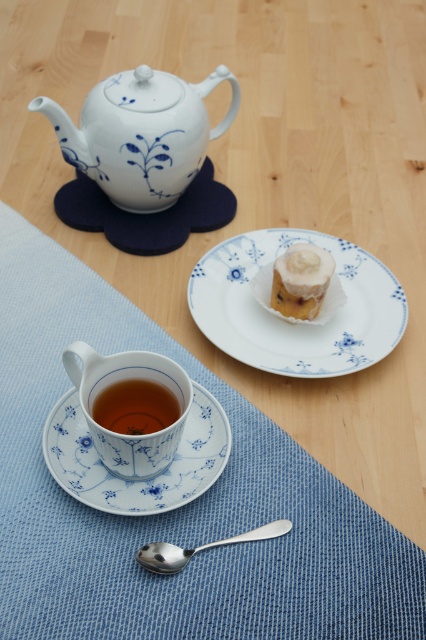
Question: Is the position of white porcelain saucer at lower center less distant than that of translucent glass cup at lower center?

Choices:
 (A) yes
 (B) no

Answer: (A)

Question: Is blue woven placemat at lower left closer to the viewer compared to satin silver spoon at lower center?

Choices:
 (A) no
 (B) yes

Answer: (B)

Question: Which object appears closest to the camera in this image?

Choices:
 (A) matte porcelain cup at lower center
 (B) white creamy cake at center

Answer: (A)

Question: Can you confirm if blue woven placemat at lower left is wider than white creamy cake at center?

Choices:
 (A) no
 (B) yes

Answer: (B)

Question: Which point is closer to the camera?

Choices:
 (A) (253, 532)
 (B) (198, 144)
 (C) (302, 276)
 (D) (253, 557)

Answer: (D)

Question: Which point is farther to the camera?

Choices:
 (A) (143, 547)
 (B) (120, 412)

Answer: (B)